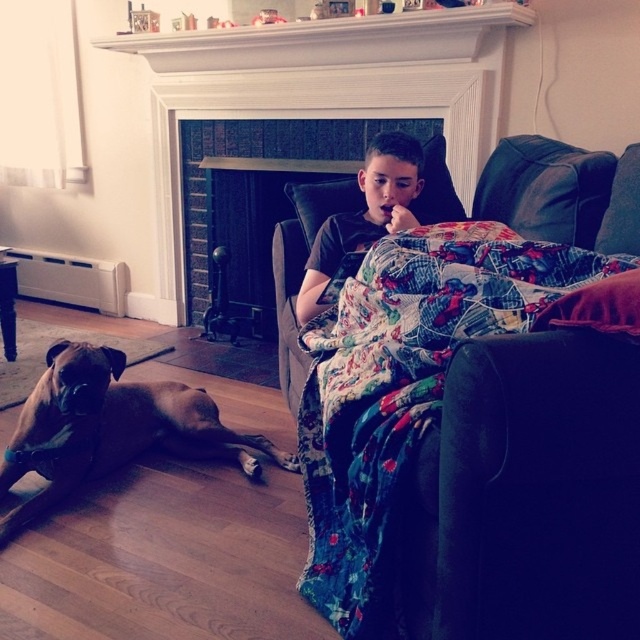
You are a parent trying to ensure your child stays warm while sitting in the dark armchair. The brick fireplace at center is above the black cotton shirt at center. Which object is positioned higher in the image?

The brick fireplace at center is positioned higher than the black cotton shirt at center.

You are trying to decide where to place a new painting. The painting is meant to hang above the brick fireplace at center. However, there is a floral cotton quilt at upper right. Is the quilt in a position that would block the view of the painting if hung there?

The floral cotton quilt at upper right is in front of the brick fireplace at center, so if the painting is hung above the brick fireplace at center, the quilt might block the view depending on the quilt placement. However, since the quilt is at upper right, it might not directly block the center area above the fireplace. Further clarification on the quilt position relative to the fireplace is needed.